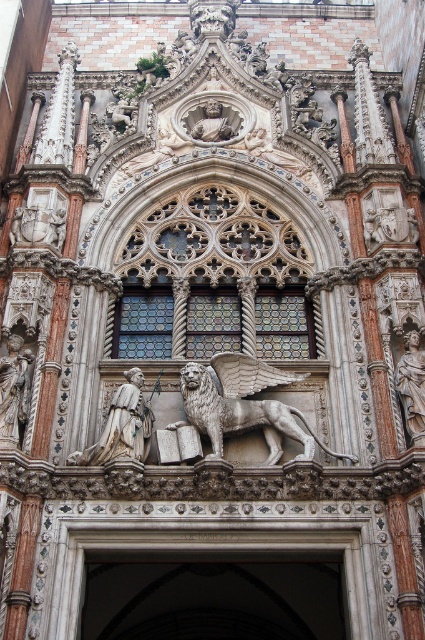
Is white stone arch at center shorter than polished stone lion at center?

Correct, white stone arch at center is not as tall as polished stone lion at center.

Is white stone arch at center in front of polished stone lion at center?

Yes, it is in front of polished stone lion at center.

The height and width of the screenshot is (640, 425). What are the coordinates of `white stone arch at center` in the screenshot? It's located at (221, 550).

Between white marble statue at center and polished stone statue at right, which one is positioned higher?

polished stone statue at right is above.

Is white marble statue at center bigger than polished stone statue at right?

Yes.

Where is `white marble statue at center`? white marble statue at center is located at coordinates (121, 426).

Can you confirm if polished stone lion at center is smaller than polished stone statue at right?

Incorrect, polished stone lion at center is not smaller in size than polished stone statue at right.

Which is behind, point (254, 419) or point (416, 429)?

Positioned behind is point (254, 419).

Is point (280, 410) closer to camera compared to point (418, 360)?

That is True.

At what (x,y) coordinates should I click in order to perform the action: click on polished stone lion at center. Please return your answer as a coordinate pair (x, y). This screenshot has height=640, width=425. Looking at the image, I should click on (244, 404).